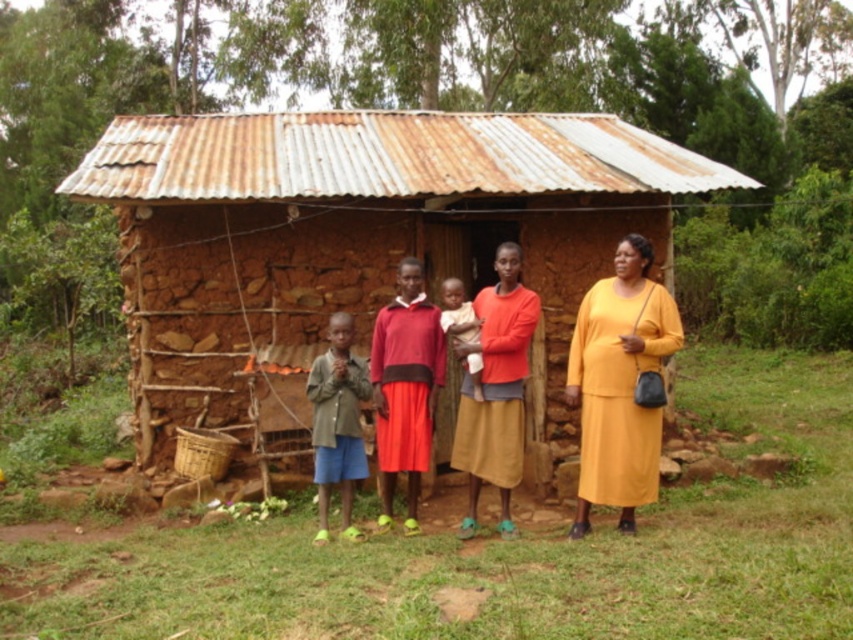
Question: Which object appears closest to the camera in this image?

Choices:
 (A) red matte skirt at center
 (B) matte yellow dress at right

Answer: (B)

Question: Among these points, which one is farthest from the camera?

Choices:
 (A) (625, 442)
 (B) (264, 333)
 (C) (489, 451)
 (D) (450, 312)

Answer: (B)

Question: Does matte yellow dress at right have a smaller size compared to red matte skirt at center?

Choices:
 (A) yes
 (B) no

Answer: (A)

Question: In this image, where is matte orange dress at center located relative to orange cotton dress at center?

Choices:
 (A) above
 (B) below

Answer: (A)

Question: Which object appears closest to the camera in this image?

Choices:
 (A) matte orange dress at center
 (B) rusty corrugated metal hut at center
 (C) red matte skirt at center
 (D) light brown skin at center

Answer: (A)

Question: Is orange cotton dress at center to the right of green fabric shirt at center from the viewer's perspective?

Choices:
 (A) yes
 (B) no

Answer: (A)